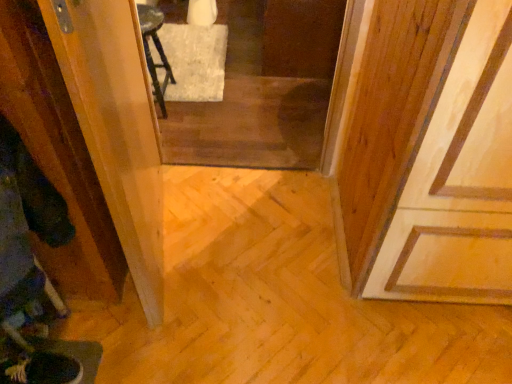
Identify the location of vacant region to the right of transparent plastic screen door at left, the second screen door in the back-to-front sequence. 251,253.